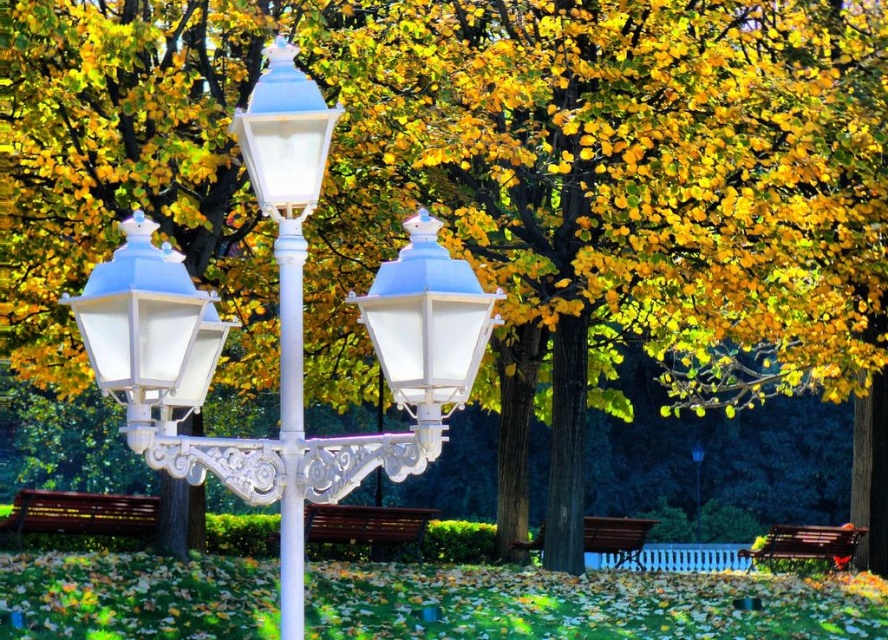
Question: Is matte white lantern at left to the left of wooden bench at lower right from the viewer's perspective?

Choices:
 (A) no
 (B) yes

Answer: (B)

Question: Can you confirm if white glossy pole at center is positioned to the right of brown wooden bench at center?

Choices:
 (A) no
 (B) yes

Answer: (A)

Question: Which object is the closest to the white glossy streetlight at center?

Choices:
 (A) wooden bench at lower right
 (B) matte white lantern at left

Answer: (B)

Question: Estimate the real-world distances between objects in this image. Which object is closer to the wooden bench at lower right?

Choices:
 (A) brown wooden bench at center
 (B) white glossy street light at center

Answer: (A)

Question: Among these objects, which one is nearest to the camera?

Choices:
 (A) white glossy pole at center
 (B) wooden park bench at lower center
 (C) white glossy streetlight at center
 (D) matte white lantern at center

Answer: (C)

Question: Can you confirm if white glossy streetlight at center is wider than brown wooden bench at center?

Choices:
 (A) no
 (B) yes

Answer: (B)